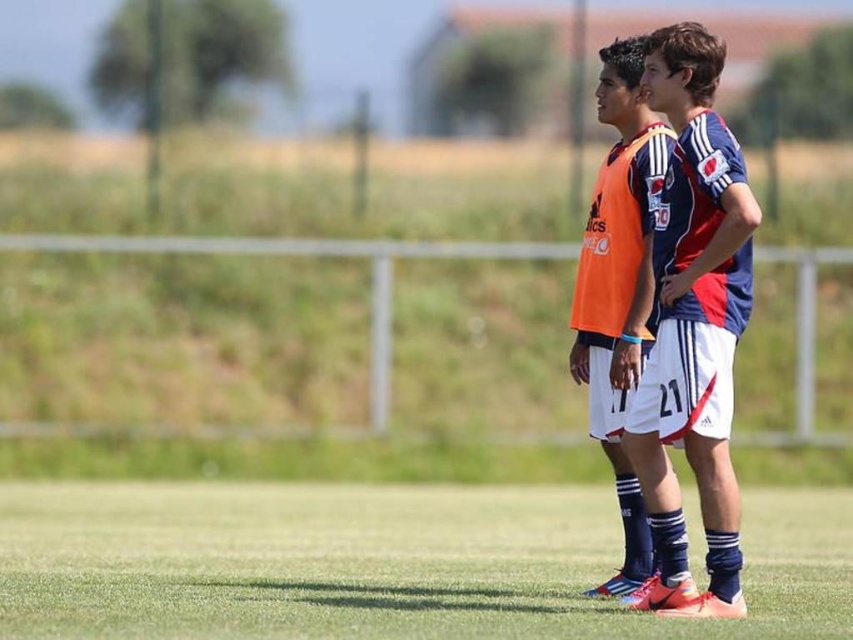
You are a soccer coach standing at the edge of the field. You want to place a cone at point (x=289, y=570) which is 12.44 meters away from you. If your assistant is standing 10 meters behind you, can they see the cone clearly once placed?

The point (x=289, y=570) is 12.44 meters away from you. Since your assistant is 10 meters behind you, they would be 22.44 meters away from the cone. Whether they can see it clearly depends on their visual acuity and the cone size, but the distance alone doesn

You are a soccer coach observing two players during practice. You notice the blue jersey at center and the orange jersey at center. Which player is closer to you?

The blue jersey at center is closer to you because it is in front of the orange jersey at center.